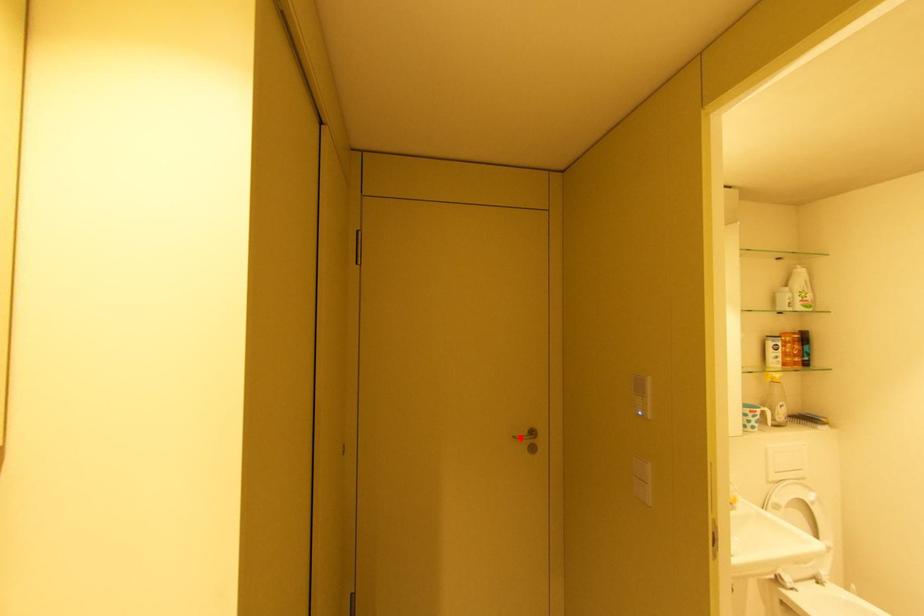
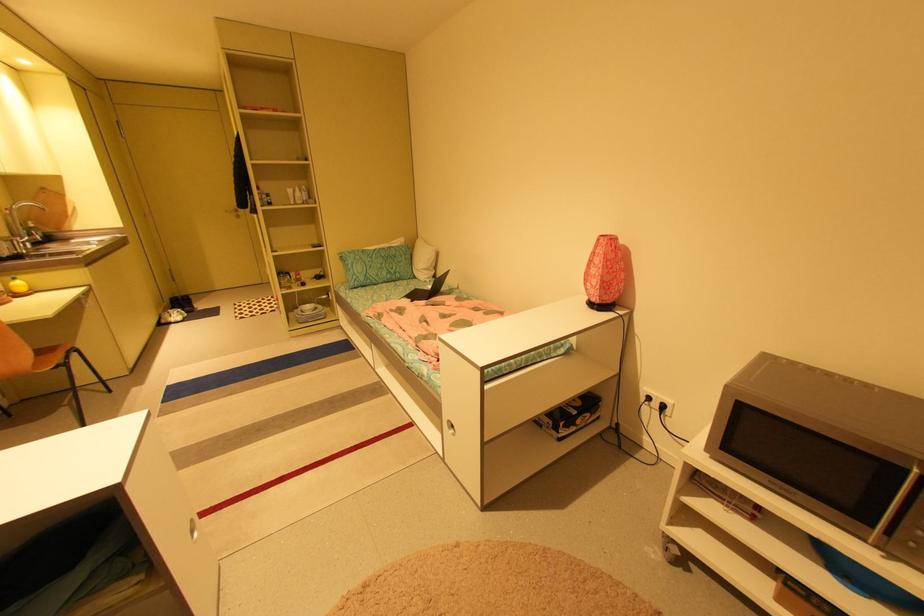
Locate, in the second image, the point that corresponds to the highlighted location in the first image.

(232, 211)